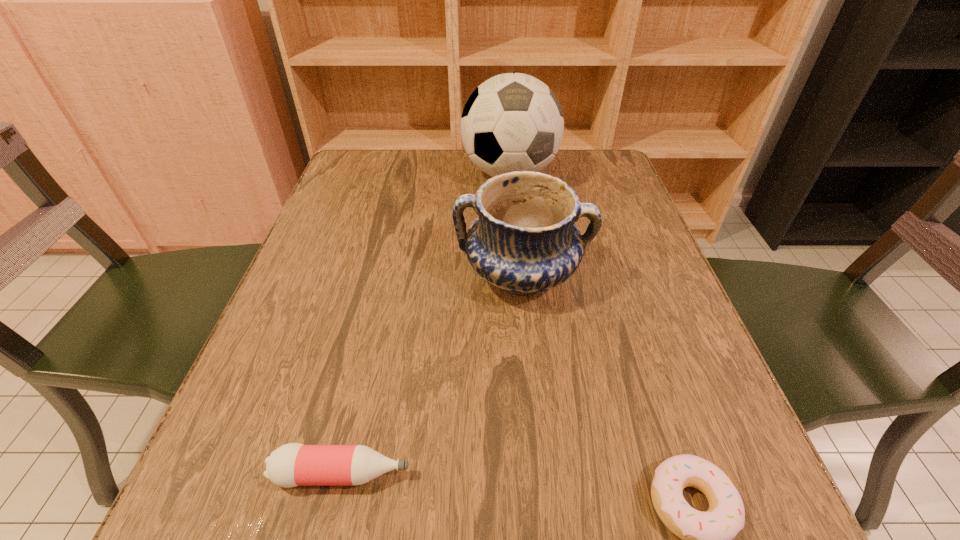
The width and height of the screenshot is (960, 540). I want to click on soccer ball, so click(512, 122).

Locate an element on the screen. the tallest object is located at coordinates coord(512,122).

Locate an element on the screen. the second tallest object is located at coordinates (524, 240).

The height and width of the screenshot is (540, 960). What are the coordinates of `the third nearest object` in the screenshot? It's located at (524, 240).

This screenshot has height=540, width=960. In order to click on the third tallest object in this screenshot , I will do `click(294, 464)`.

At what (x,y) coordinates should I click in order to perform the action: click on bottle. Please return your answer as a coordinate pair (x, y). The height and width of the screenshot is (540, 960). Looking at the image, I should click on (294, 464).

At what (x,y) coordinates should I click in order to perform the action: click on free region located on the main logo of the farthest object. Please return your answer as a coordinate pair (x, y). Looking at the image, I should click on [x=516, y=241].

Where is `blank area located on the right of the pottery`? Image resolution: width=960 pixels, height=540 pixels. blank area located on the right of the pottery is located at coordinates (667, 275).

At what (x,y) coordinates should I click in order to perform the action: click on free spot located 0.400m with the cap open on the second shortest object. Please return your answer as a coordinate pair (x, y). Looking at the image, I should click on (708, 474).

Image resolution: width=960 pixels, height=540 pixels. Find the location of `object that is at the far edge`. object that is at the far edge is located at coordinates (512, 122).